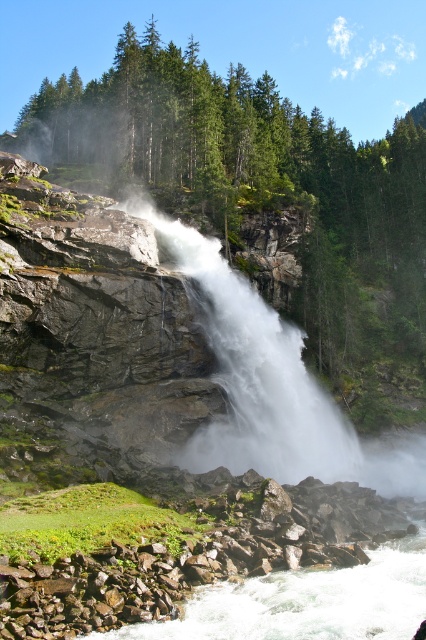
In the scene shown: Which of these two, green matte tree at center or white frothy water at lower center, stands shorter?

Standing shorter between the two is white frothy water at lower center.

Who is taller, green matte tree at center or white frothy water at lower center?

green matte tree at center

I want to click on green matte tree at center, so click(256, 179).